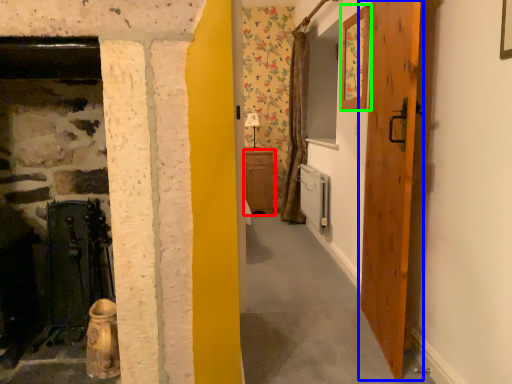
Question: Which object is the closest to the cabinetry (highlighted by a red box)? Choose among these: door (highlighted by a blue box) or picture frame (highlighted by a green box).

Choices:
 (A) door
 (B) picture frame

Answer: (B)